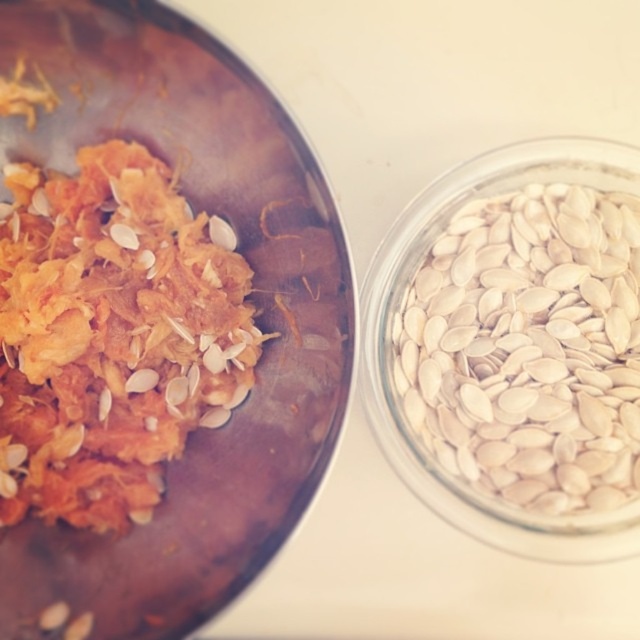
You are preparing a salad and need to know which container has more height to hold ingredients. You have the orange shredded food at left and the white smooth pumpkin seeds at right in front of you. Which one has greater height?

The orange shredded food at left has greater height than the white smooth pumpkin seeds at right.

You are arranging items on a table and need to place a new item between the orange shredded food at left and the clear glass jar at right. Based on their positions, where should you place the new item?

The orange shredded food at left is located at point (109,337), so you should place the new item to the right of the orange shredded food at left since it is closer to the center of the table compared to the clear glass jar at right.